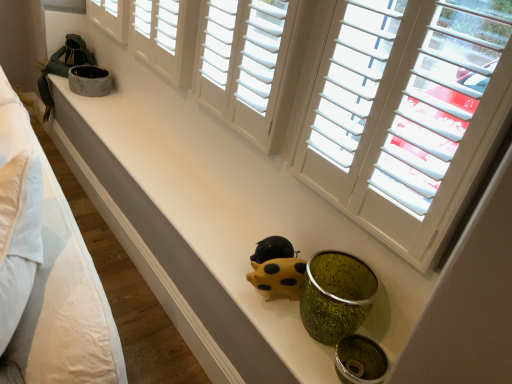
At what (x,y) coordinates should I click in order to perform the action: click on vacant space in front of yellow matte piggy bank at center. Please return your answer as a coordinate pair (x, y). Looking at the image, I should click on (281, 322).